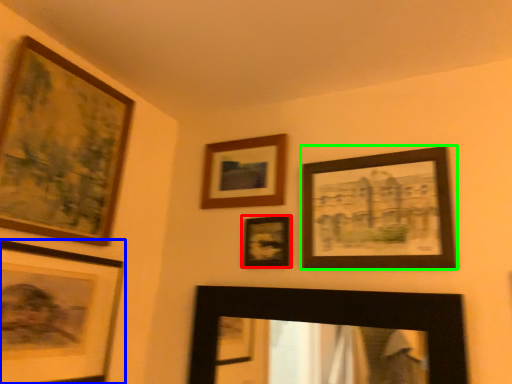
Question: Which is farther away from picture frame (highlighted by a red box)? picture frame (highlighted by a blue box) or picture frame (highlighted by a green box)?

Choices:
 (A) picture frame
 (B) picture frame

Answer: (A)